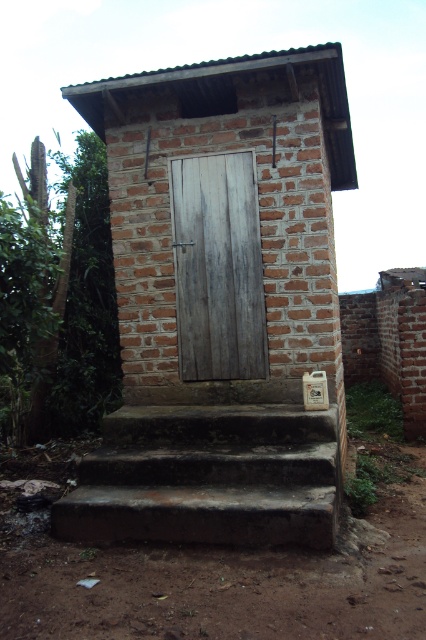
Question: Which point is closer to the camera?

Choices:
 (A) (192, 509)
 (B) (210, 227)
 (C) (213, 84)

Answer: (A)

Question: Is dark brown concrete stairs at center positioned before weathered wood door at center?

Choices:
 (A) yes
 (B) no

Answer: (A)

Question: Considering the real-world distances, which object is closest to the brick/rough wooden door at center?

Choices:
 (A) weathered wood door at center
 (B) dark brown concrete stairs at center

Answer: (A)

Question: Does brick/rough wooden door at center appear over weathered wood door at center?

Choices:
 (A) no
 (B) yes

Answer: (B)

Question: Which point appears closest to the camera in this image?

Choices:
 (A) (247, 182)
 (B) (290, 237)

Answer: (B)

Question: Observing the image, what is the correct spatial positioning of dark brown concrete stairs at center in reference to weathered wood door at center?

Choices:
 (A) right
 (B) left

Answer: (B)